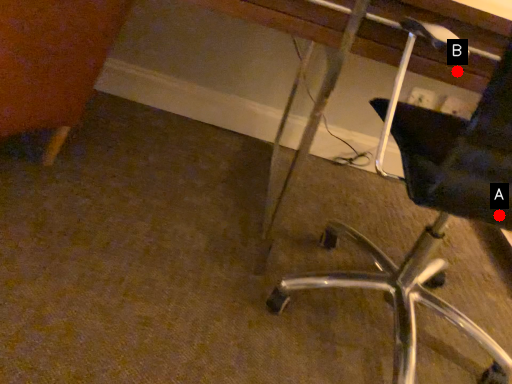
Question: Two points are circled on the image, labeled by A and B beside each circle. Which point is closer to the camera?

Choices:
 (A) A is closer
 (B) B is closer

Answer: (A)